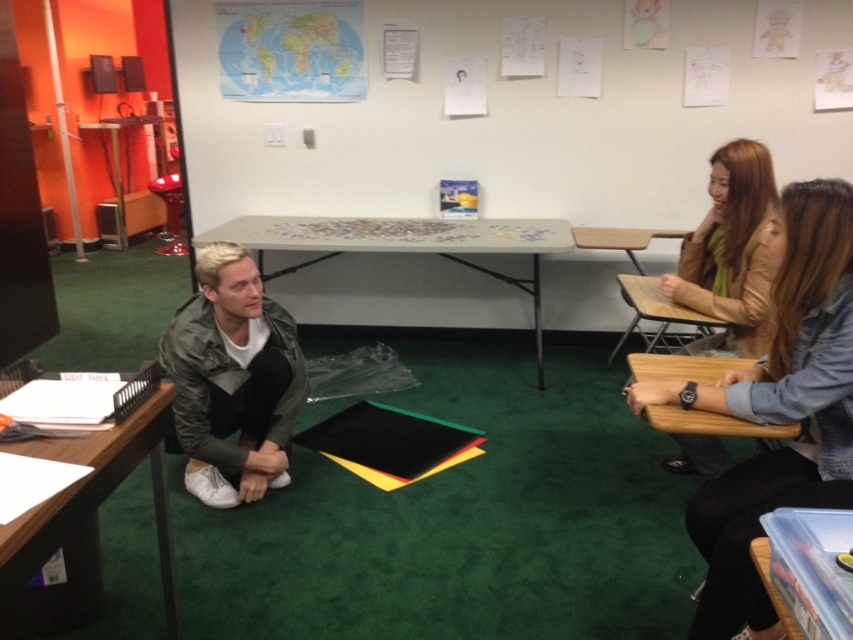
Does wooden desk at lower left appear over wooden table at right?

No.

Is wooden desk at lower left taller than wooden table at right?

Yes, wooden desk at lower left is taller than wooden table at right.

Is point (22, 579) closer to viewer compared to point (653, 413)?

Yes, point (22, 579) is in front of point (653, 413).

Identify the location of wooden desk at lower left. (91, 497).

Does denim jacket at right have a greater height compared to clear plastic container at lower right?

Yes, denim jacket at right is taller than clear plastic container at lower right.

Is denim jacket at right above clear plastic container at lower right?

Yes, denim jacket at right is above clear plastic container at lower right.

Identify the location of denim jacket at right. This screenshot has width=853, height=640. (776, 408).

Describe the element at coordinates (231, 380) in the screenshot. This screenshot has width=853, height=640. I see `camouflage jacket at lower left` at that location.

Is camouflage jacket at lower left closer to camera compared to clear plastic container at lower right?

That is False.

Which is behind, point (172, 358) or point (801, 576)?

The point (172, 358) is more distant.

At what (x,y) coordinates should I click in order to perform the action: click on camouflage jacket at lower left. Please return your answer as a coordinate pair (x, y). This screenshot has width=853, height=640. Looking at the image, I should click on (231, 380).